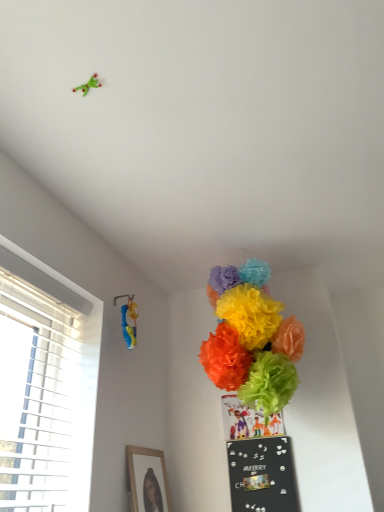
Question: Considering the relative positions of black matte bulletin board at lower center and blue plastic toy at upper left in the image provided, is black matte bulletin board at lower center to the right of blue plastic toy at upper left from the viewer's perspective?

Choices:
 (A) yes
 (B) no

Answer: (A)

Question: Does black matte bulletin board at lower center have a greater height compared to blue plastic toy at upper left?

Choices:
 (A) yes
 (B) no

Answer: (A)

Question: Is black matte bulletin board at lower center further to camera compared to blue plastic toy at upper left?

Choices:
 (A) yes
 (B) no

Answer: (A)

Question: Is black matte bulletin board at lower center surrounding blue plastic toy at upper left?

Choices:
 (A) yes
 (B) no

Answer: (B)

Question: Can you confirm if black matte bulletin board at lower center is wider than blue plastic toy at upper left?

Choices:
 (A) yes
 (B) no

Answer: (B)

Question: Is wooden framed picture at lower left inside or outside of bright tissue paper pom-poms at center?

Choices:
 (A) outside
 (B) inside

Answer: (A)

Question: Would you say wooden framed picture at lower left is to the left or to the right of bright tissue paper pom-poms at center in the picture?

Choices:
 (A) right
 (B) left

Answer: (B)

Question: From their relative heights in the image, would you say wooden framed picture at lower left is taller or shorter than bright tissue paper pom-poms at center?

Choices:
 (A) short
 (B) tall

Answer: (A)

Question: From a real-world perspective, is wooden framed picture at lower left above or below bright tissue paper pom-poms at center?

Choices:
 (A) above
 (B) below

Answer: (B)

Question: From a real-world perspective, relative to blue plastic toy at upper left, is black matte bulletin board at lower center vertically above or below?

Choices:
 (A) above
 (B) below

Answer: (B)

Question: Based on their positions, is black matte bulletin board at lower center located to the left or right of blue plastic toy at upper left?

Choices:
 (A) left
 (B) right

Answer: (B)

Question: Is black matte bulletin board at lower center in front of or behind blue plastic toy at upper left in the image?

Choices:
 (A) behind
 (B) front

Answer: (A)

Question: Would you say black matte bulletin board at lower center is inside or outside blue plastic toy at upper left?

Choices:
 (A) inside
 (B) outside

Answer: (B)

Question: From a real-world perspective, relative to bright tissue paper pom-poms at center, is blue plastic toy at upper left vertically above or below?

Choices:
 (A) below
 (B) above

Answer: (A)

Question: In terms of size, does blue plastic toy at upper left appear bigger or smaller than bright tissue paper pom-poms at center?

Choices:
 (A) small
 (B) big

Answer: (A)